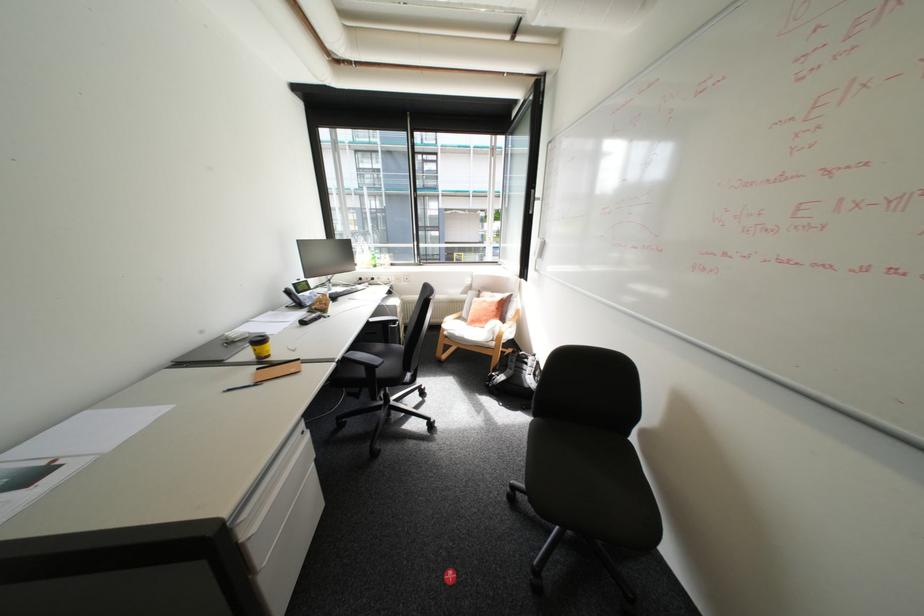
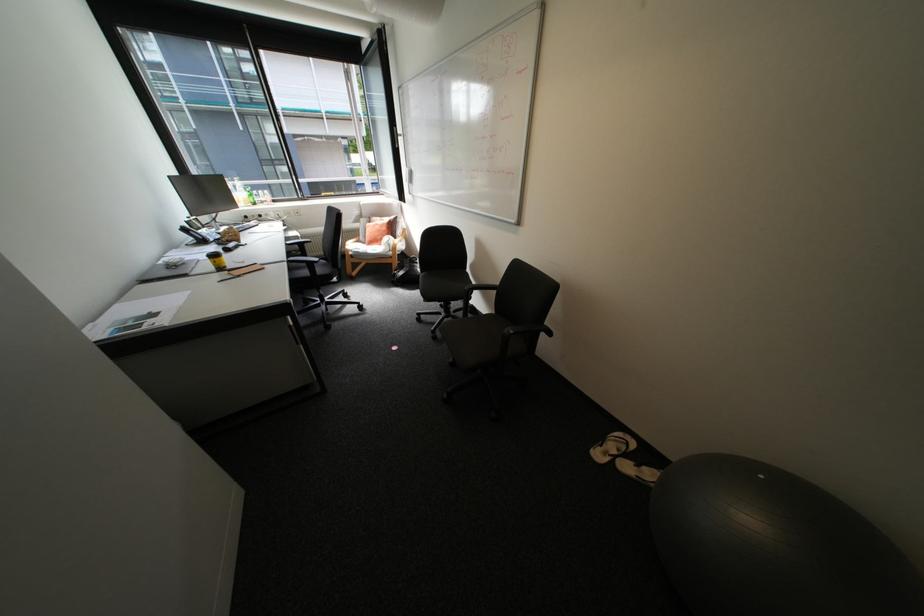
In the second image, find the point that corresponds to (x=348, y=357) in the first image.

(295, 259)